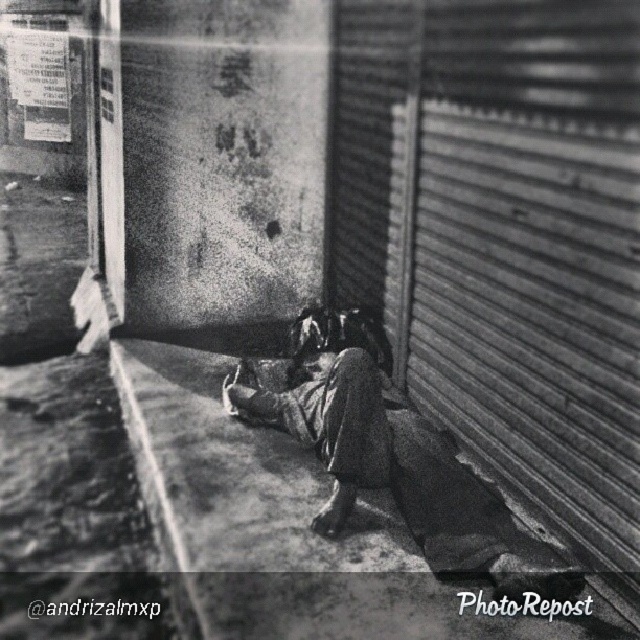
Based on the photo, you are a delivery person needing to place a 1.2 meter tall package against the wall in the scene. The metallic corrugated at right and the ragged fabric woman at center are in the way. Which object should you move to make space?

The metallic corrugated at right is taller than the ragged fabric woman at center, so you should move the metallic corrugated at right to make space for the tall package.

You are a delivery person who needs to leave a package at the exact location of the point marked at (390, 452). You see the ragged fabric woman at center. Where should you place the package relative to the ragged fabric woman at center?

The ragged fabric woman at center is located at point (390, 452), so you should place the package exactly where the ragged fabric woman at center is standing.

You are a delivery person trying to locate a specific address in the city. You have a map that marks a point at coordinates (532, 308). According to the image, what feature is located at that point?

The point at coordinates (532, 308) corresponds to the metallic corrugated at right.